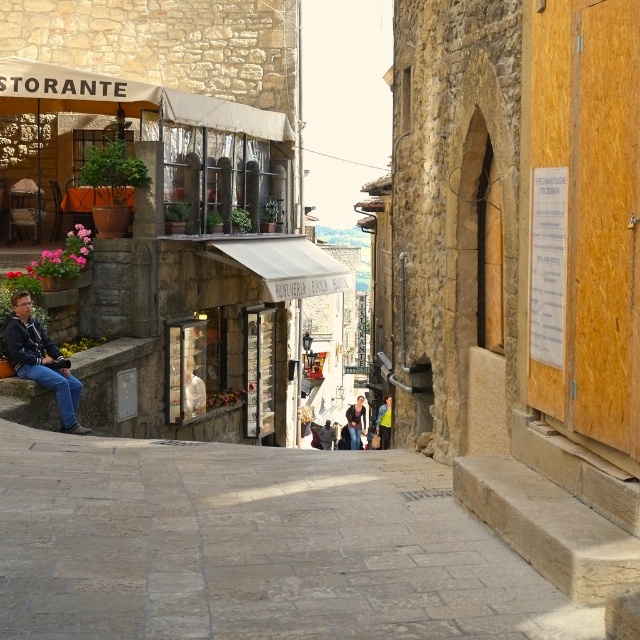
You are a tourist carrying a backpack and want to walk through the gray stone alley at center. The dark blue denim jacket at lower left is blocking your path. Can you pass through the alley without removing the jacket?

The gray stone alley at center has a larger size compared to dark blue denim jacket at lower left, so yes, you can pass through the alley without removing the jacket since the alley is wider than the jacket.

Based on the photo, you are standing on the cobblestone street in front of the TORANTE restaurant. You see a dark blue denim jacket at lower left. Where exactly is the dark blue denim jacket located in the scene?

The dark blue denim jacket at lower left is located at the 2D coordinates point (40, 360) in the scene.